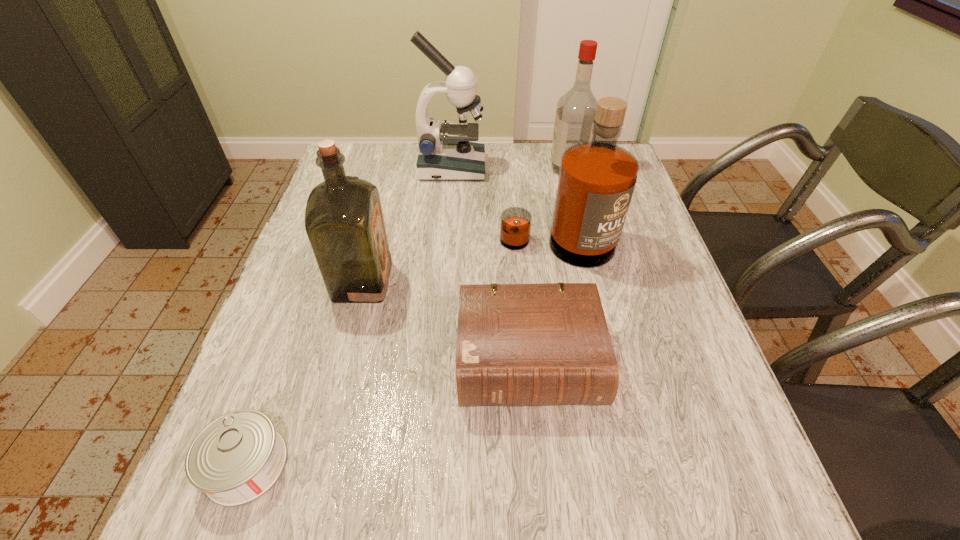
Identify the location of vacant space that's between the can and the farthest liquor. Image resolution: width=960 pixels, height=540 pixels. (408, 316).

Locate an element on the screen. This screenshot has height=540, width=960. vacant point located between the farthest liquor and the shortest object is located at coordinates (408, 316).

At what (x,y) coordinates should I click in order to perform the action: click on vacant area that lies between the can and the leftmost liquor. Please return your answer as a coordinate pair (x, y). Looking at the image, I should click on (304, 373).

Identify the location of unoccupied position between the farthest liquor and the leftmost liquor. (466, 225).

Identify which object is the closest to the second nearest object. Please provide its 2D coordinates. Your answer should be formatted as a tuple, i.e. [(x, y)], where the tuple contains the x and y coordinates of a point satisfying the conditions above.

[(596, 180)]

Find the location of a particular element. object that stands as the fifth closest to the leftmost liquor is located at coordinates (576, 109).

What are the coordinates of `liquor that stands as the third closest to the microscope` in the screenshot? It's located at (344, 222).

Identify the location of the second closest liquor to the microscope. This screenshot has width=960, height=540. pos(576,109).

Where is `free space that satisfies the following two spatial constraints: 1. on the front-facing side of the farthest liquor; 2. on the front side of the can`? The height and width of the screenshot is (540, 960). free space that satisfies the following two spatial constraints: 1. on the front-facing side of the farthest liquor; 2. on the front side of the can is located at coordinates (645, 464).

Image resolution: width=960 pixels, height=540 pixels. I want to click on vacant space that satisfies the following two spatial constraints: 1. on the front-facing side of the farthest liquor; 2. on the front side of the shortest object, so click(x=645, y=464).